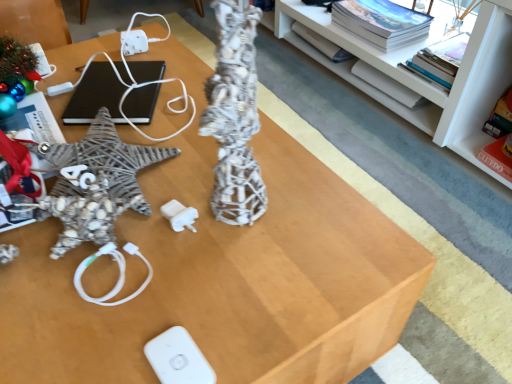
Question: In terms of height, does black matte laptop at upper left look taller or shorter compared to white glossy shelf at upper center?

Choices:
 (A) tall
 (B) short

Answer: (B)

Question: Considering the relative positions of black matte laptop at upper left and white glossy shelf at upper center in the image provided, is black matte laptop at upper left to the left or to the right of white glossy shelf at upper center?

Choices:
 (A) left
 (B) right

Answer: (A)

Question: Based on their relative distances, which object is nearer to the shiny metallic ornament at upper left?

Choices:
 (A) white glossy shelf at upper center
 (B) white matte wii controller at lower center
 (C) black matte laptop at upper left

Answer: (C)

Question: Which object is positioned closest to the black matte laptop at upper left?

Choices:
 (A) white matte wii controller at lower center
 (B) shiny metallic ornament at upper left
 (C) white glossy shelf at upper center

Answer: (B)